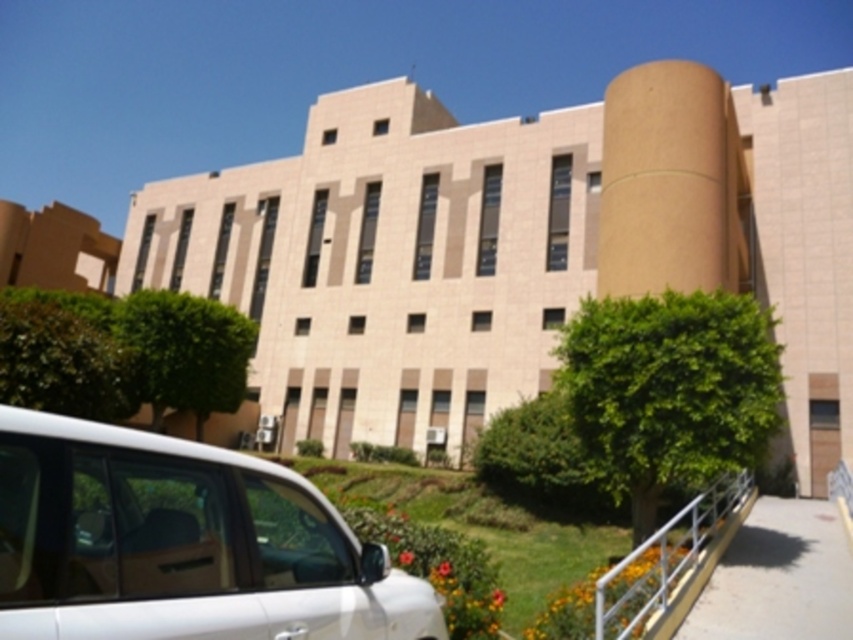
You are a delivery person arriving at the building and need to park your vehicle. You see the white matte van at lower left and the white metal railing at lower right. Which object is closer to the entrance of the building?

The white matte van at lower left is positioned on the left side of the white metal railing at lower right, so the van is closer to the entrance than the railing.

You are standing at the entrance of the modern building and want to locate two specific points marked on the facade. The first point is at coordinate point (x=49, y=592) and the second is at point (x=718, y=508). From your vantage point, which point appears closer to you?

Point (x=49, y=592) is in front of point (x=718, y=508), so it appears closer to you.